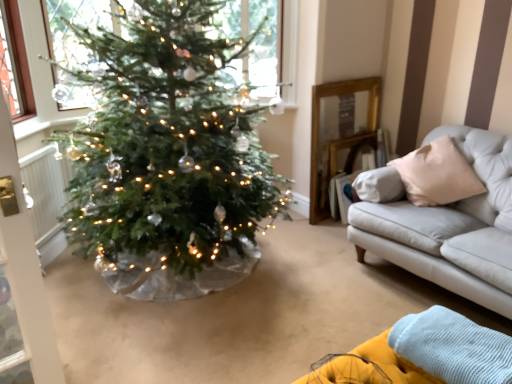
Question: Is yellow fabric couch at lower right inside or outside of white textured radiator at left?

Choices:
 (A) outside
 (B) inside

Answer: (A)

Question: From the image's perspective, relative to white textured radiator at left, is yellow fabric couch at lower right above or below?

Choices:
 (A) above
 (B) below

Answer: (B)

Question: Considering the real-world distances, which object is farthest from the yellow fabric couch at lower right?

Choices:
 (A) clear glass window at upper center
 (B) white textured radiator at left

Answer: (B)

Question: Estimate the real-world distances between objects in this image. Which object is closer to the yellow fabric couch at lower right?

Choices:
 (A) white textured radiator at left
 (B) clear glass window at upper center

Answer: (B)